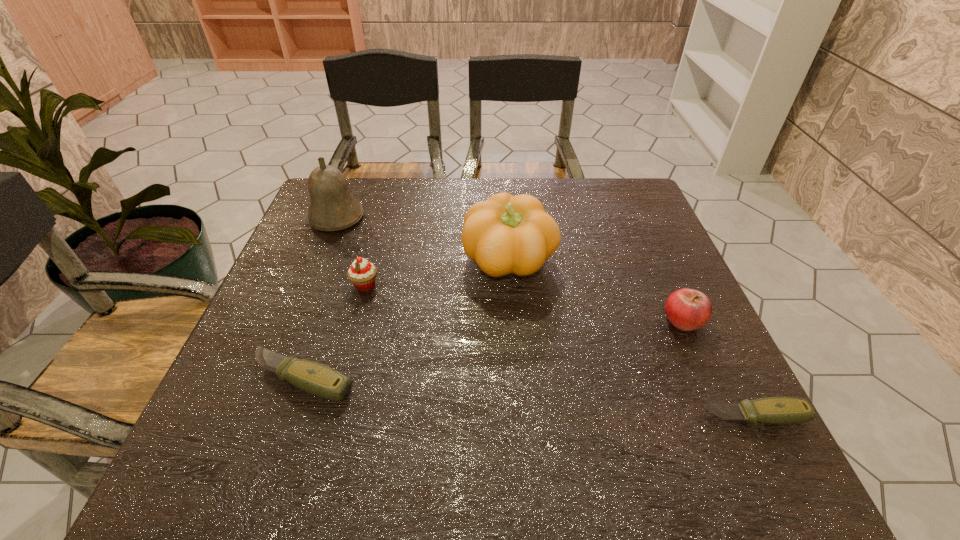
The height and width of the screenshot is (540, 960). In order to click on vacant space located 0.090m on the left of the fourth object from left to right in this screenshot , I will do [x=426, y=261].

At what (x,y) coordinates should I click in order to perform the action: click on free region located 0.060m on the right of the cupcake. Please return your answer as a coordinate pair (x, y). Looking at the image, I should click on (405, 285).

Identify the location of free space located on the right of the bell. Image resolution: width=960 pixels, height=540 pixels. (500, 218).

Image resolution: width=960 pixels, height=540 pixels. I want to click on free space located on the left of the fourth farthest object, so click(x=574, y=320).

The width and height of the screenshot is (960, 540). I want to click on object that is positioned at the far edge, so [x=332, y=207].

This screenshot has width=960, height=540. I want to click on pocketknife that is at the left edge, so click(315, 378).

In order to click on bell located in the left edge section of the desktop in this screenshot , I will do `click(332, 207)`.

At what (x,y) coordinates should I click in order to perform the action: click on pocketknife that is at the right edge. Please return your answer as a coordinate pair (x, y). This screenshot has width=960, height=540. Looking at the image, I should click on (771, 410).

Identify the location of apple present at the right edge. The image size is (960, 540). (687, 309).

Identify the location of object present at the far left corner. The image size is (960, 540). [332, 207].